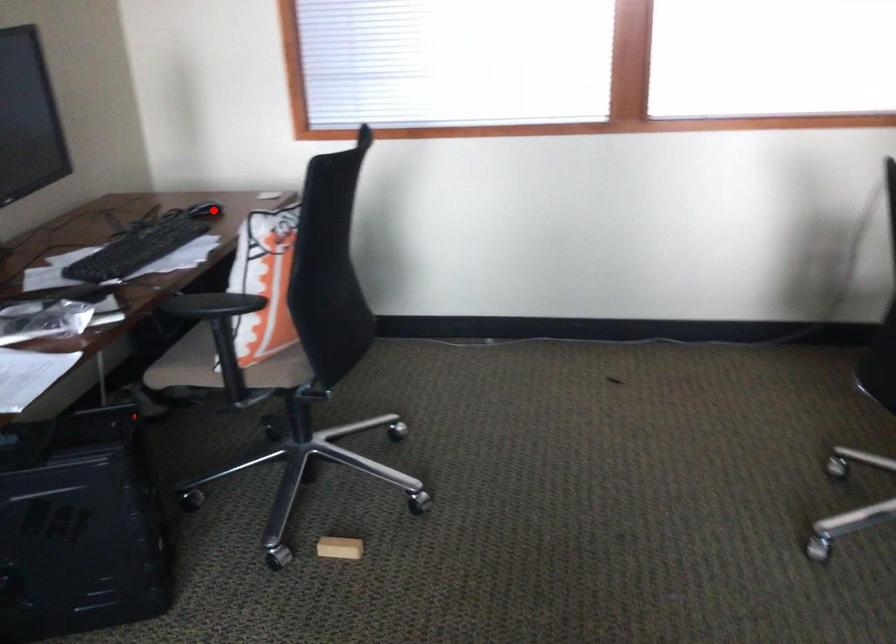
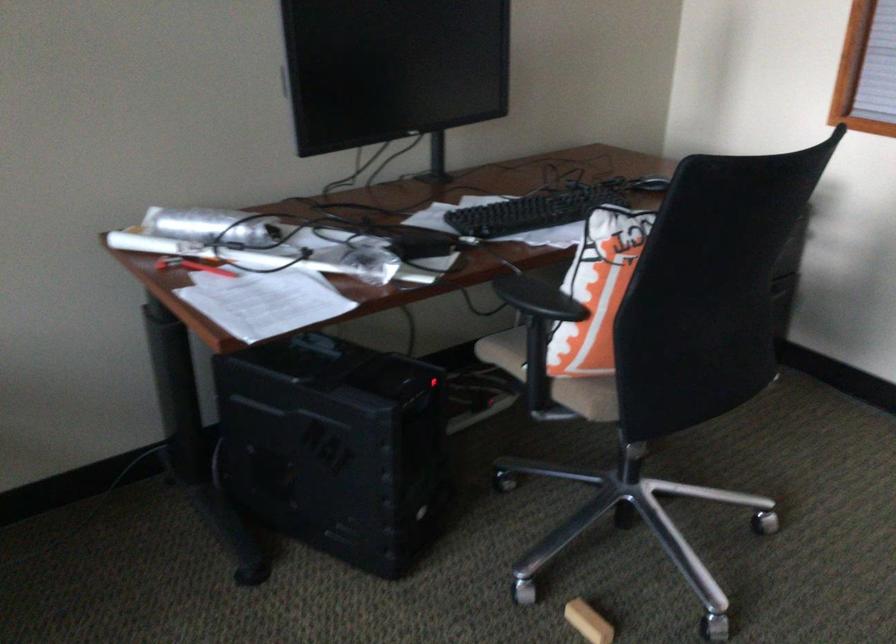
In the second image, find the point that corresponds to the highlighted location in the first image.

(648, 185)